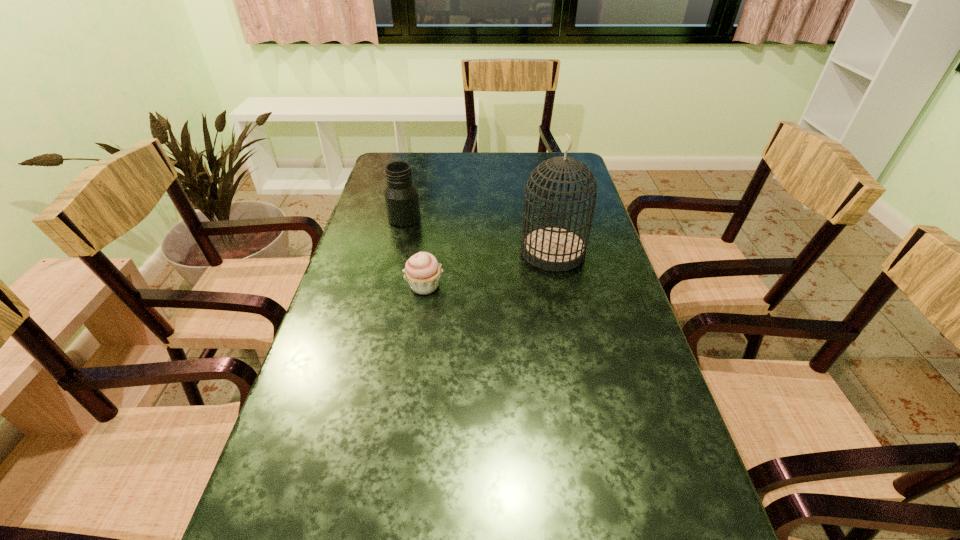
In order to click on birdcage in this screenshot , I will do `click(550, 247)`.

Where is `the second farthest object`? the second farthest object is located at coordinates (550, 247).

Image resolution: width=960 pixels, height=540 pixels. I want to click on jar, so [x=401, y=195].

What are the coordinates of `the farthest object` in the screenshot? It's located at (401, 195).

Identify the location of cupcake. The height and width of the screenshot is (540, 960). pyautogui.click(x=422, y=271).

Where is `the nearest object`? The height and width of the screenshot is (540, 960). the nearest object is located at coordinates (422, 271).

Where is `vacant space located on the back of the birdcage`? Image resolution: width=960 pixels, height=540 pixels. vacant space located on the back of the birdcage is located at coordinates (542, 199).

This screenshot has height=540, width=960. I want to click on vacant space located 0.190m on the right of the second shortest object, so click(481, 218).

Locate an element on the screen. This screenshot has width=960, height=540. vacant space located 0.290m on the front of the nearest object is located at coordinates (408, 401).

Identify the location of object that is at the left edge. (401, 195).